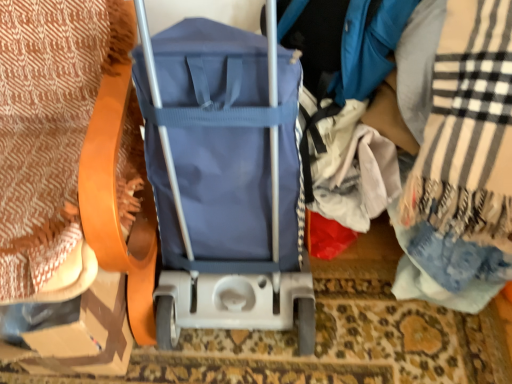
Identify the location of cardboard at left. This screenshot has width=512, height=384. (87, 334).

This screenshot has width=512, height=384. What are the coordinates of `patterned fabric blanket at left, arranged as the first blanket when viewed from the left` in the screenshot? It's located at (49, 130).

Describe the element at coordinates (49, 130) in the screenshot. I see `patterned fabric blanket at left, the second blanket when ordered from right to left` at that location.

You are a GUI agent. You are given a task and a screenshot of the screen. Output one action in this format:
    pyautogui.click(x=<x>, y=<y>)
    Task: Click on the plaid woolen blanket at right, the second blanket positioned from the left
    Image resolution: width=512 pixels, height=384 pixels.
    Given the screenshot: What is the action you would take?
    pyautogui.click(x=463, y=167)

Where is `blanket lying on the right of cardboard at left`? blanket lying on the right of cardboard at left is located at coordinates (463, 167).

Which is more to the right, plaid woolen blanket at right, which appears as the 1th blanket when viewed from the right, or cardboard at left?

From the viewer's perspective, plaid woolen blanket at right, which appears as the 1th blanket when viewed from the right, appears more on the right side.

From the picture: Is plaid woolen blanket at right, which appears as the 1th blanket when viewed from the right, far from cardboard at left?

No, there isn't a large distance between plaid woolen blanket at right, which appears as the 1th blanket when viewed from the right, and cardboard at left.

Based on their sizes in the image, would you say plaid woolen blanket at right, which appears as the 1th blanket when viewed from the right, is bigger or smaller than patterned fabric blanket at left, the second blanket when ordered from right to left?

Clearly, plaid woolen blanket at right, which appears as the 1th blanket when viewed from the right, is smaller in size than patterned fabric blanket at left, the second blanket when ordered from right to left.

Which object is more forward, plaid woolen blanket at right, which appears as the 1th blanket when viewed from the right, or patterned fabric blanket at left, the second blanket when ordered from right to left?

Positioned in front is patterned fabric blanket at left, the second blanket when ordered from right to left.

Could you measure the distance between plaid woolen blanket at right, the second blanket positioned from the left, and patterned fabric blanket at left, arranged as the first blanket when viewed from the left?

A distance of 78.47 centimeters exists between plaid woolen blanket at right, the second blanket positioned from the left, and patterned fabric blanket at left, arranged as the first blanket when viewed from the left.

Are plaid woolen blanket at right, the second blanket positioned from the left, and patterned fabric blanket at left, the second blanket when ordered from right to left, far apart?

No, plaid woolen blanket at right, the second blanket positioned from the left, is in close proximity to patterned fabric blanket at left, the second blanket when ordered from right to left.

Is cardboard at left shorter than patterned fabric blanket at left, arranged as the first blanket when viewed from the left?

Correct, cardboard at left is not as tall as patterned fabric blanket at left, arranged as the first blanket when viewed from the left.

Is there a large distance between cardboard at left and patterned fabric blanket at left, arranged as the first blanket when viewed from the left?

No, there isn't a large distance between cardboard at left and patterned fabric blanket at left, arranged as the first blanket when viewed from the left.

From the image's perspective, is cardboard at left below patterned fabric blanket at left, the second blanket when ordered from right to left?

Yes, from the image's perspective, cardboard at left is below patterned fabric blanket at left, the second blanket when ordered from right to left.

Locate an element on the screen. blanket that appears on the right of patterned fabric blanket at left, the second blanket when ordered from right to left is located at coordinates (463, 167).

Between patterned fabric blanket at left, the second blanket when ordered from right to left, and plaid woolen blanket at right, which appears as the 1th blanket when viewed from the right, which one has smaller width?

With smaller width is plaid woolen blanket at right, which appears as the 1th blanket when viewed from the right.

In the image, is patterned fabric blanket at left, the second blanket when ordered from right to left, positioned in front of or behind plaid woolen blanket at right, which appears as the 1th blanket when viewed from the right?

Visually, patterned fabric blanket at left, the second blanket when ordered from right to left, is located in front of plaid woolen blanket at right, which appears as the 1th blanket when viewed from the right.

Based on the photo, can we say cardboard at left lies outside plaid woolen blanket at right, the second blanket positioned from the left?

Yes, cardboard at left is outside of plaid woolen blanket at right, the second blanket positioned from the left.

Are cardboard at left and plaid woolen blanket at right, which appears as the 1th blanket when viewed from the right, far apart?

No, cardboard at left is in close proximity to plaid woolen blanket at right, which appears as the 1th blanket when viewed from the right.

Does cardboard at left have a lesser width compared to plaid woolen blanket at right, the second blanket positioned from the left?

Indeed, cardboard at left has a lesser width compared to plaid woolen blanket at right, the second blanket positioned from the left.

Considering the relative sizes of cardboard at left and plaid woolen blanket at right, the second blanket positioned from the left, in the image provided, is cardboard at left shorter than plaid woolen blanket at right, the second blanket positioned from the left,?

Yes.

Would you say patterned fabric blanket at left, the second blanket when ordered from right to left, is outside cardboard at left?

Yes, patterned fabric blanket at left, the second blanket when ordered from right to left, is outside of cardboard at left.

Between patterned fabric blanket at left, arranged as the first blanket when viewed from the left, and cardboard at left, which one has more height?

Standing taller between the two is patterned fabric blanket at left, arranged as the first blanket when viewed from the left.

From a real-world perspective, is patterned fabric blanket at left, arranged as the first blanket when viewed from the left, physically located above or below cardboard at left?

Clearly, from a real-world perspective, patterned fabric blanket at left, arranged as the first blanket when viewed from the left, is above cardboard at left.

Considering the positions of objects patterned fabric blanket at left, the second blanket when ordered from right to left, and cardboard at left in the image provided, who is behind, patterned fabric blanket at left, the second blanket when ordered from right to left, or cardboard at left?

cardboard at left.

What are the coordinates of `blanket lying on the right of cardboard at left` in the screenshot? It's located at (463, 167).

Find the location of `blanket below the plaid woolen blanket at right, which appears as the 1th blanket when viewed from the right (from the image's perspective)`. blanket below the plaid woolen blanket at right, which appears as the 1th blanket when viewed from the right (from the image's perspective) is located at coordinates (49, 130).

Considering their positions, is cardboard at left positioned further to patterned fabric blanket at left, arranged as the first blanket when viewed from the left, than plaid woolen blanket at right, the second blanket positioned from the left?

plaid woolen blanket at right, the second blanket positioned from the left.

From the image, which object appears to be farther from cardboard at left, patterned fabric blanket at left, the second blanket when ordered from right to left, or plaid woolen blanket at right, the second blanket positioned from the left?

The object further to cardboard at left is plaid woolen blanket at right, the second blanket positioned from the left.

From the image, which object appears to be farther from cardboard at left, plaid woolen blanket at right, the second blanket positioned from the left, or patterned fabric blanket at left, arranged as the first blanket when viewed from the left?

Among the two, plaid woolen blanket at right, the second blanket positioned from the left, is located further to cardboard at left.

Based on their spatial positions, is cardboard at left or patterned fabric blanket at left, the second blanket when ordered from right to left, closer to plaid woolen blanket at right, which appears as the 1th blanket when viewed from the right?

cardboard at left is positioned closer to the anchor plaid woolen blanket at right, which appears as the 1th blanket when viewed from the right.

From the image, which object appears to be farther from patterned fabric blanket at left, the second blanket when ordered from right to left, plaid woolen blanket at right, which appears as the 1th blanket when viewed from the right, or cardboard at left?

Among the two, plaid woolen blanket at right, which appears as the 1th blanket when viewed from the right, is located further to patterned fabric blanket at left, the second blanket when ordered from right to left.

Estimate the real-world distances between objects in this image. Which object is closer to plaid woolen blanket at right, the second blanket positioned from the left, patterned fabric blanket at left, the second blanket when ordered from right to left, or cardboard at left?

Based on the image, cardboard at left appears to be nearer to plaid woolen blanket at right, the second blanket positioned from the left.

Where is `cardboard box between patterned fabric blanket at left, arranged as the first blanket when viewed from the left, and plaid woolen blanket at right, the second blanket positioned from the left`? The height and width of the screenshot is (384, 512). cardboard box between patterned fabric blanket at left, arranged as the first blanket when viewed from the left, and plaid woolen blanket at right, the second blanket positioned from the left is located at coordinates (87, 334).